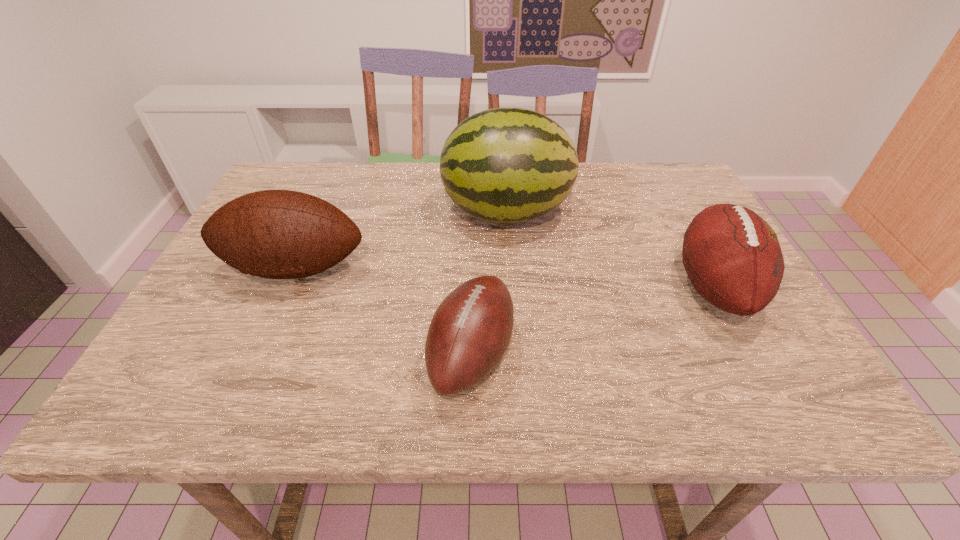
Image resolution: width=960 pixels, height=540 pixels. I want to click on unoccupied area between the watermelon and the leftmost football (American), so pyautogui.click(x=400, y=240).

You are a GUI agent. You are given a task and a screenshot of the screen. Output one action in this format:
    pyautogui.click(x=<x>, y=<y>)
    Task: Click on the free space between the rightmost football (American) and the leftmost football (American)
    
    Given the screenshot: What is the action you would take?
    pyautogui.click(x=505, y=278)

Where is `free space between the shortest football (American) and the rightmost football (American)`? free space between the shortest football (American) and the rightmost football (American) is located at coordinates (593, 320).

At what (x,y) coordinates should I click in order to perform the action: click on vacant space that's between the leftmost object and the tallest object. Please return your answer as a coordinate pair (x, y). This screenshot has width=960, height=540. Looking at the image, I should click on (400, 240).

Where is `empty location between the leftmost object and the rightmost object`? The height and width of the screenshot is (540, 960). empty location between the leftmost object and the rightmost object is located at coordinates (505, 278).

At what (x,y) coordinates should I click in order to perform the action: click on free point between the leftmost object and the second football (American) from right to left. Please return your answer as a coordinate pair (x, y). This screenshot has height=540, width=960. Looking at the image, I should click on (383, 311).

Locate an element on the screen. The height and width of the screenshot is (540, 960). empty location between the tallest object and the leftmost football (American) is located at coordinates (400, 240).

Image resolution: width=960 pixels, height=540 pixels. Identify the location of vacant region between the shortest object and the leftmost object. (383, 311).

Identify which object is the third closest to the leftmost object. Please provide its 2D coordinates. Your answer should be formatted as a tuple, i.e. [(x, y)], where the tuple contains the x and y coordinates of a point satisfying the conditions above.

[(732, 256)]

The height and width of the screenshot is (540, 960). I want to click on object that is the third nearest to the shortest object, so click(x=732, y=256).